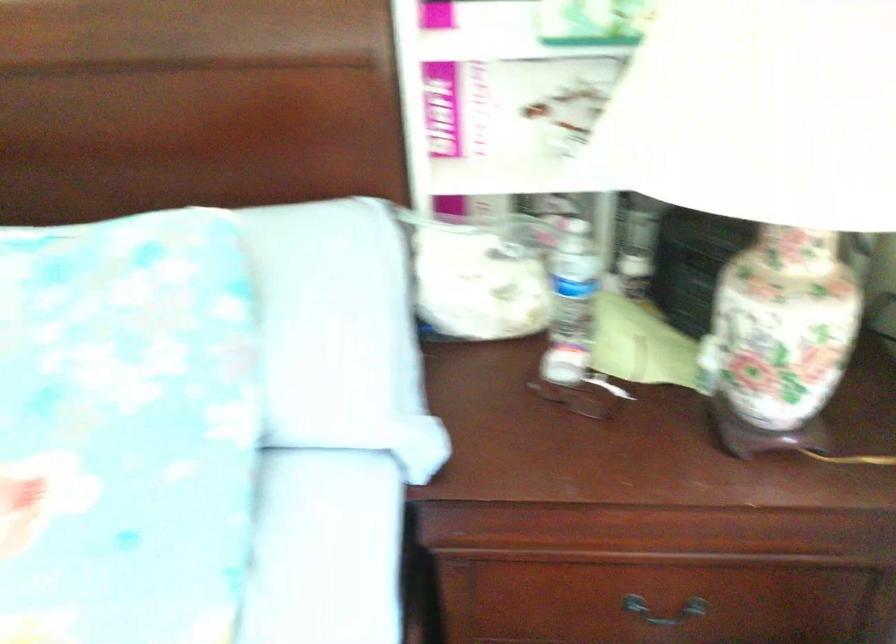
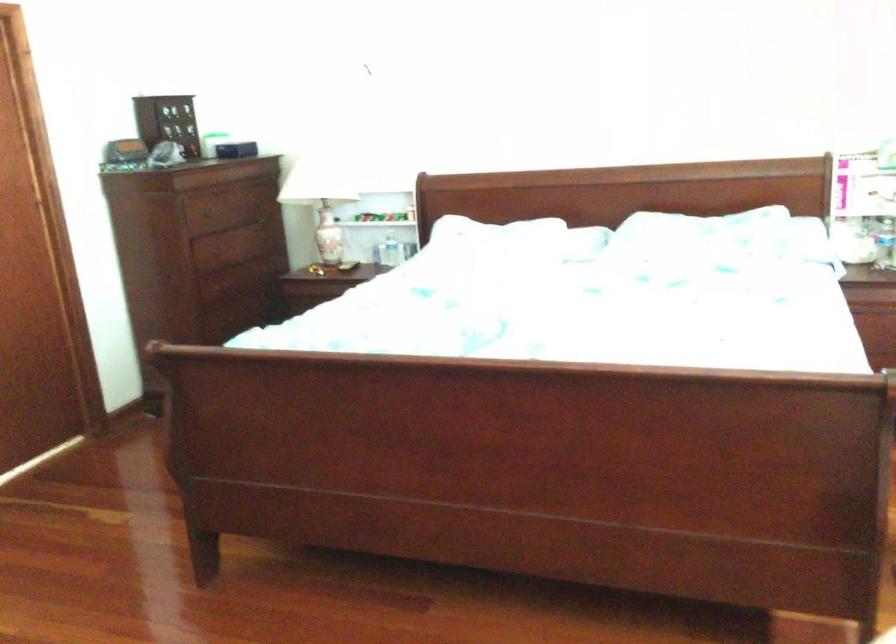
Locate, in the second image, the point that corresponds to (x=576, y=442) in the first image.

(883, 243)